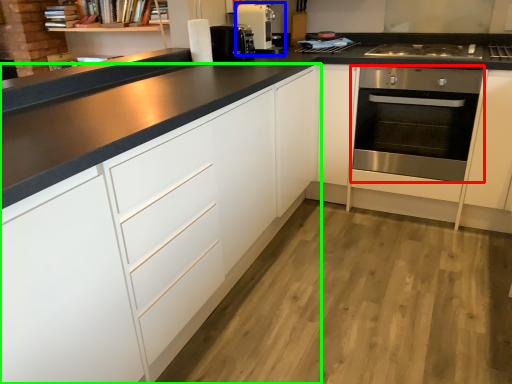
Question: Which is farther away from oven (highlighted by a red box)? home appliance (highlighted by a blue box) or cabinetry (highlighted by a green box)?

Choices:
 (A) home appliance
 (B) cabinetry

Answer: (B)